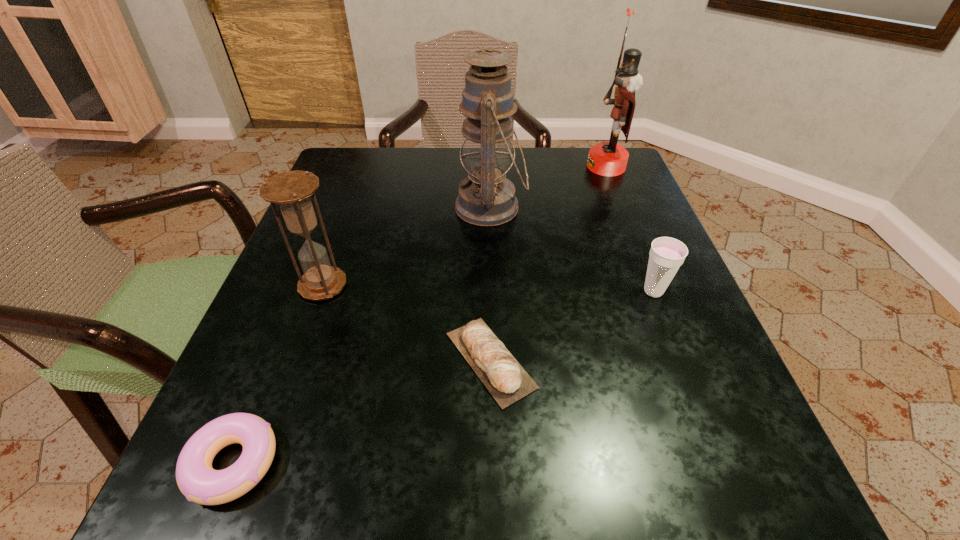
Where is `vacant region between the nutcracker and the cup`? This screenshot has height=540, width=960. vacant region between the nutcracker and the cup is located at coordinates (630, 229).

The height and width of the screenshot is (540, 960). I want to click on empty space between the fifth farthest object and the farthest object, so pyautogui.click(x=548, y=264).

Identify the location of empty space that is in between the fourth shortest object and the nearest object. (278, 374).

Identify the location of vacant space in between the nutcracker and the fourth tallest object. This screenshot has width=960, height=540. (630, 229).

Find the location of a particular element. This screenshot has height=540, width=960. unoccupied position between the hourglass and the third shortest object is located at coordinates (489, 288).

The image size is (960, 540). Identify the location of free space between the doughnut and the fourth tallest object. (444, 377).

You are a GUI agent. You are given a task and a screenshot of the screen. Output one action in this format:
    pyautogui.click(x=<x>, y=<y>)
    Task: Click on the free space that is in between the fifth farthest object and the farthest object
    
    Given the screenshot: What is the action you would take?
    point(548,264)

Locate an element on the screen. This screenshot has width=960, height=540. empty space between the fifth nearest object and the third shortest object is located at coordinates (572, 249).

Image resolution: width=960 pixels, height=540 pixels. In order to click on vacant space in between the fourth tallest object and the third tallest object in this screenshot , I will do `click(489, 288)`.

Where is `object that is the second closest one to the nearest object`? The height and width of the screenshot is (540, 960). object that is the second closest one to the nearest object is located at coordinates (291, 190).